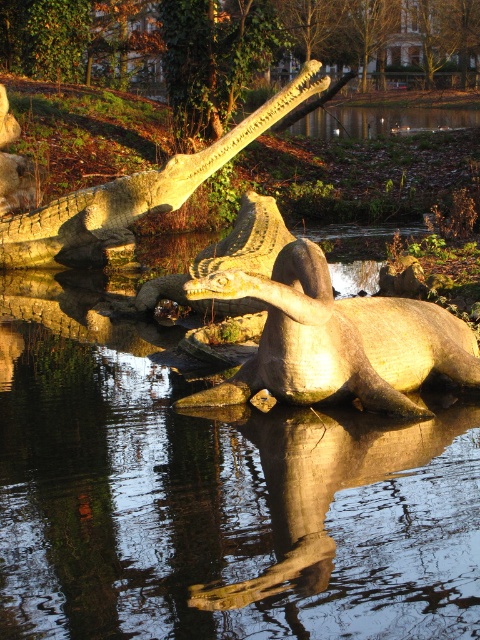
Is green leafy tree at upper center above matte stone crocodile at center?

Yes, green leafy tree at upper center is above matte stone crocodile at center.

Can you confirm if green leafy tree at upper center is bigger than matte stone crocodile at center?

Correct, green leafy tree at upper center is larger in size than matte stone crocodile at center.

Identify the location of green leafy tree at upper center. The width and height of the screenshot is (480, 640). [227, 44].

Find the location of `green leafy tree at upper center`. green leafy tree at upper center is located at coordinates (227, 44).

Which of these two, green leafy tree at upper center or matte stone crocodile at upper center, stands taller?

green leafy tree at upper center

Who is shorter, green leafy tree at upper center or matte stone crocodile at upper center?

With less height is matte stone crocodile at upper center.

Find the location of a particular element. This screenshot has width=480, height=640. green leafy tree at upper center is located at coordinates (227, 44).

This screenshot has width=480, height=640. I want to click on green leafy tree at upper center, so click(x=227, y=44).

Is point (467, 376) closer to viewer compared to point (316, 65)?

Yes, point (467, 376) is closer to viewer.

Does point (474, 342) lie in front of point (182, 188)?

That is True.

Identify the location of matte stone crocodile at center. This screenshot has width=480, height=640. (336, 340).